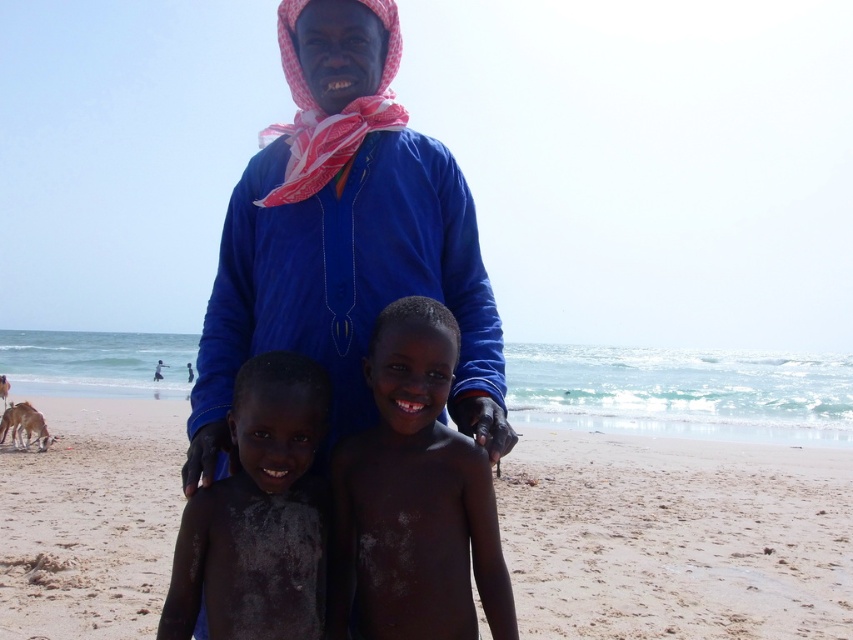
Between blue cotton shirt at center and smooth skin boy at center, which one appears on the right side from the viewer's perspective?

From the viewer's perspective, smooth skin boy at center appears more on the right side.

Between blue cotton shirt at center and smooth skin boy at center, which one is positioned higher?

blue cotton shirt at center is higher up.

Does point (202, 368) lie in front of point (413, 461)?

No, (202, 368) is further to viewer.

Identify the location of blue cotton shirt at center. The image size is (853, 640). (343, 237).

Is point (99, 552) farther from camera compared to point (245, 387)?

Yes.

Based on the photo, is sandy beach at center wider than dark skin/rough skin child at center?

Yes.

Describe the element at coordinates (676, 536) in the screenshot. I see `sandy beach at center` at that location.

The width and height of the screenshot is (853, 640). In order to click on sandy beach at center in this screenshot , I will do `click(676, 536)`.

Does blue cotton shirt at center have a lesser width compared to dark skin/rough skin child at center?

No.

Is point (305, 40) more distant than point (326, 396)?

Yes, point (305, 40) is farther from viewer.

The height and width of the screenshot is (640, 853). Find the location of `blue cotton shirt at center`. blue cotton shirt at center is located at coordinates (343, 237).